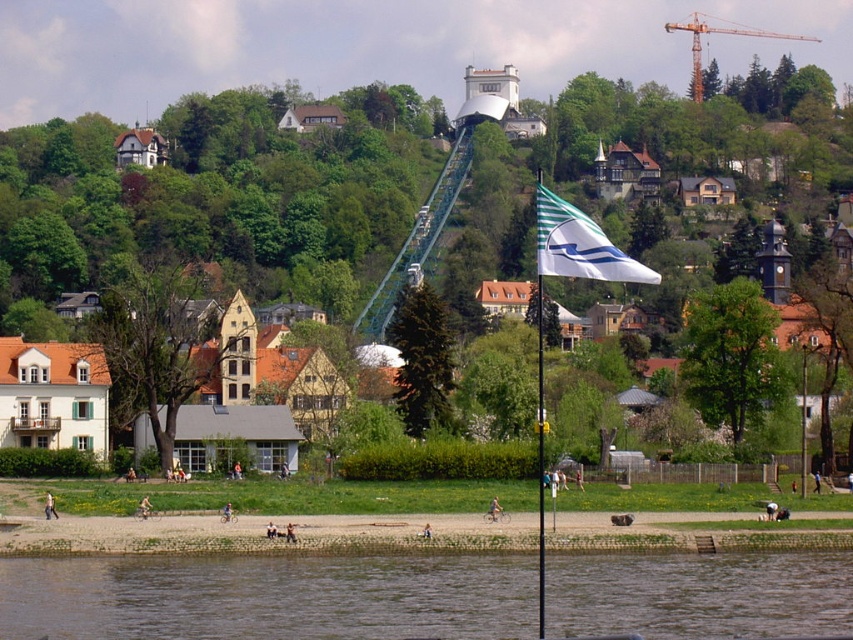
What do you see at coordinates (579, 244) in the screenshot? The height and width of the screenshot is (640, 853). I see `white fabric flag at center` at bounding box center [579, 244].

Locate an element on the screen. Image resolution: width=853 pixels, height=640 pixels. white fabric flag at center is located at coordinates (579, 244).

Does brown muddy water at lower center appear on the right side of orange metallic crane at upper center?

No, brown muddy water at lower center is not to the right of orange metallic crane at upper center.

Is brown muddy water at lower center in front of orange metallic crane at upper center?

Yes, it is.

This screenshot has width=853, height=640. I want to click on brown muddy water at lower center, so click(x=268, y=596).

Which is above, white matte flag at center or brown muddy water at lower center?

white matte flag at center is above.

Can you confirm if white matte flag at center is shorter than brown muddy water at lower center?

No, white matte flag at center is not shorter than brown muddy water at lower center.

Find the location of a particular element. Image resolution: width=853 pixels, height=640 pixels. white matte flag at center is located at coordinates (239, 198).